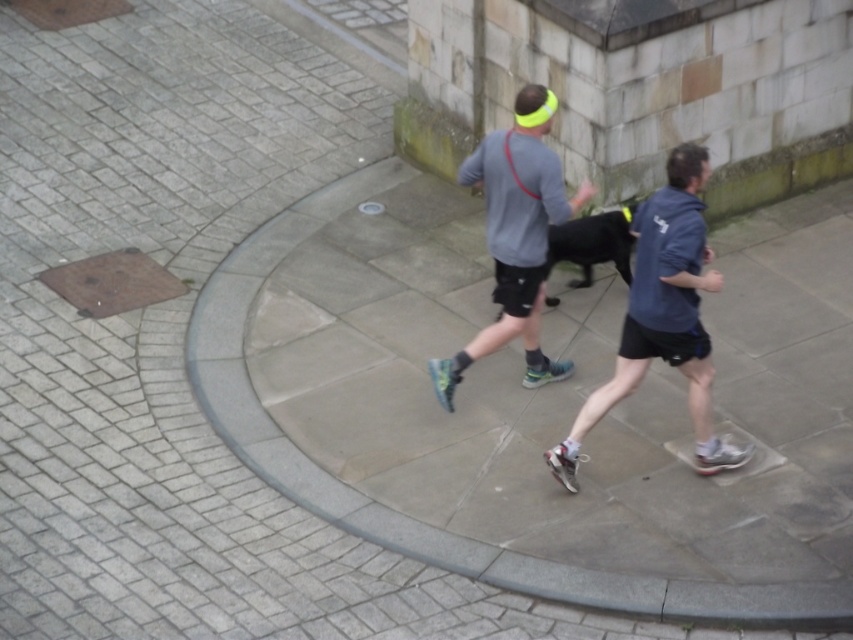
Question: Which object is closer to the camera taking this photo?

Choices:
 (A) blue fabric shirt at center
 (B) black smooth dog at center

Answer: (A)

Question: Is blue fabric shirt at center smaller than black smooth dog at center?

Choices:
 (A) no
 (B) yes

Answer: (A)

Question: Which of the following is the closest to the observer?

Choices:
 (A) gray matte shirt at center
 (B) black smooth dog at center

Answer: (A)

Question: Is blue fabric shirt at center wider than black smooth dog at center?

Choices:
 (A) yes
 (B) no

Answer: (A)

Question: Which of the following is the farthest from the observer?

Choices:
 (A) blue fabric shirt at center
 (B) gray matte shirt at center

Answer: (B)

Question: Does blue fabric shirt at center lie in front of gray matte shirt at center?

Choices:
 (A) no
 (B) yes

Answer: (B)